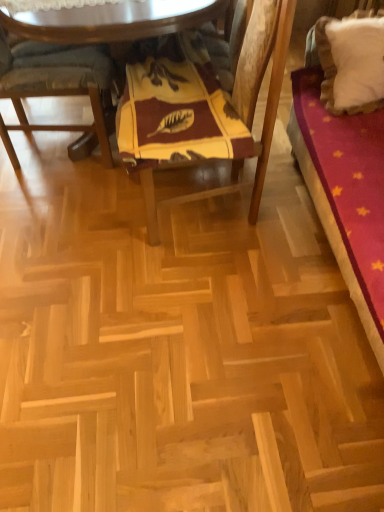
Question: Is yellow fabric cushion at center, acting as the 1th chair starting from the right, at the left side of white fluffy pillow at upper right?

Choices:
 (A) no
 (B) yes

Answer: (B)

Question: Is yellow fabric cushion at center, acting as the second chair starting from the left, located outside white fluffy pillow at upper right?

Choices:
 (A) yes
 (B) no

Answer: (A)

Question: Is yellow fabric cushion at center, acting as the second chair starting from the left, oriented towards white fluffy pillow at upper right?

Choices:
 (A) no
 (B) yes

Answer: (A)

Question: Considering the relative positions of yellow fabric cushion at center, acting as the second chair starting from the left, and white fluffy pillow at upper right in the image provided, is yellow fabric cushion at center, acting as the second chair starting from the left, behind white fluffy pillow at upper right?

Choices:
 (A) yes
 (B) no

Answer: (B)

Question: From the image's perspective, is yellow fabric cushion at center, acting as the second chair starting from the left, on top of white fluffy pillow at upper right?

Choices:
 (A) no
 (B) yes

Answer: (A)

Question: Relative to velvet red bed at right, is yellowvelvet-like fabricblanket at center in front or behind?

Choices:
 (A) front
 (B) behind

Answer: (B)

Question: Based on their sizes in the image, would you say yellowvelvet-like fabricblanket at center is bigger or smaller than velvet red bed at right?

Choices:
 (A) small
 (B) big

Answer: (A)

Question: From the image's perspective, relative to velvet red bed at right, is yellowvelvet-like fabricblanket at center above or below?

Choices:
 (A) below
 (B) above

Answer: (B)

Question: In terms of width, does yellowvelvet-like fabricblanket at center look wider or thinner when compared to velvet red bed at right?

Choices:
 (A) thin
 (B) wide

Answer: (B)

Question: Is point (362, 109) positioned closer to the camera than point (48, 81)?

Choices:
 (A) closer
 (B) farther

Answer: (A)

Question: Which is correct: velvet red bed at right is inside wooden cushioned chair at left, the 1th chair positioned from the left, or outside of it?

Choices:
 (A) outside
 (B) inside

Answer: (A)

Question: From a real-world perspective, relative to wooden cushioned chair at left, the 2th chair viewed from the right, is velvet red bed at right vertically above or below?

Choices:
 (A) below
 (B) above

Answer: (B)

Question: From their relative heights in the image, would you say velvet red bed at right is taller or shorter than wooden cushioned chair at left, the 1th chair positioned from the left?

Choices:
 (A) short
 (B) tall

Answer: (B)

Question: Would you say natural wood parquet floor at center is inside or outside white fluffy pillow at upper right?

Choices:
 (A) inside
 (B) outside

Answer: (B)

Question: From the image's perspective, relative to white fluffy pillow at upper right, is natural wood parquet floor at center above or below?

Choices:
 (A) below
 (B) above

Answer: (A)